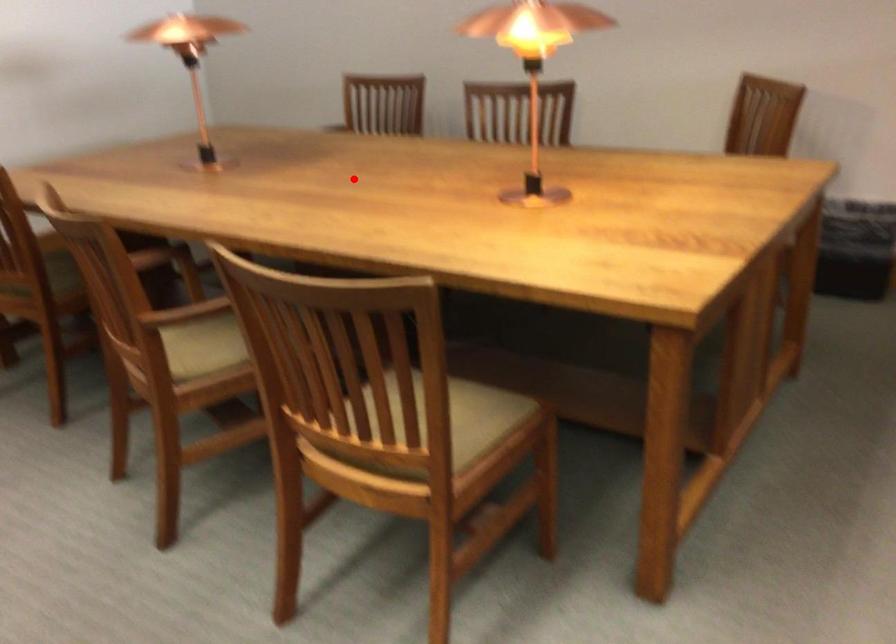
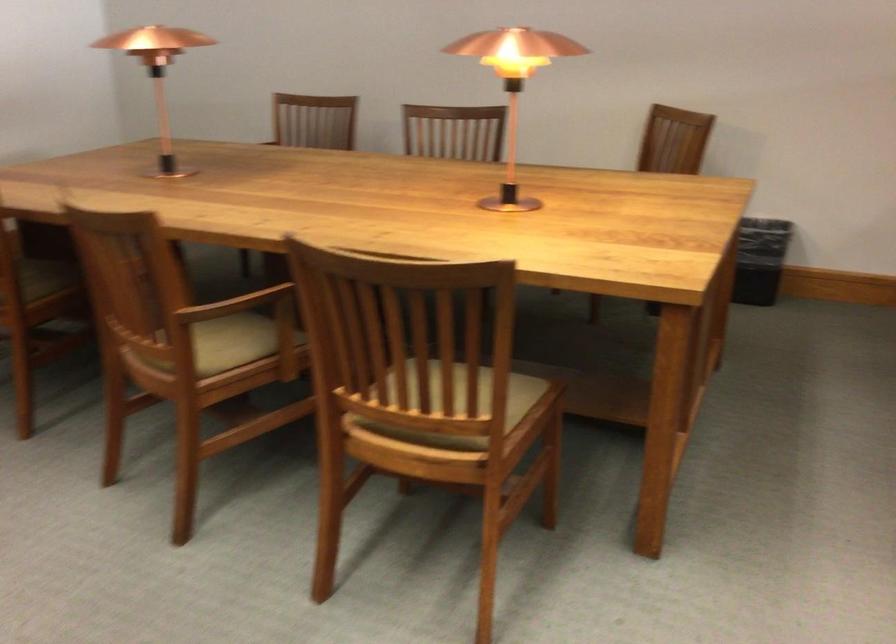
The point at the highlighted location is marked in the first image. Where is the corresponding point in the second image?

(332, 189)